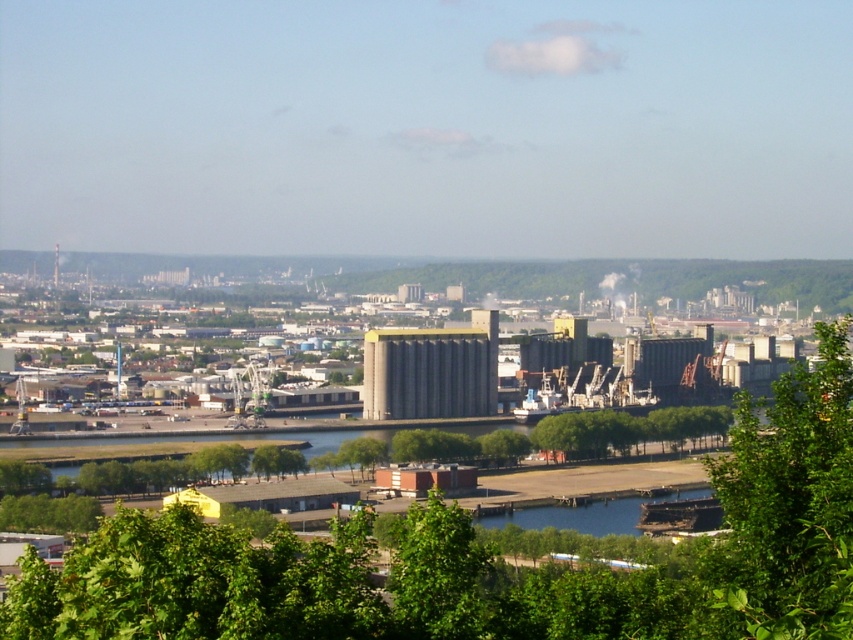
Between green leafy tree at lower right and gray concrete silos at center, which one is positioned lower?

green leafy tree at lower right

Between green leafy tree at lower right and gray concrete silos at center, which one appears on the right side from the viewer's perspective?

green leafy tree at lower right is more to the right.

Is point (837, 346) positioned in front of point (437, 353)?

That is False.

Where is `green leafy tree at lower right`? green leafy tree at lower right is located at coordinates (790, 502).

Measure the distance between gray concrete silos at center and camera.

gray concrete silos at center is 646.85 meters away from camera.

Between gray concrete silos at center and green leafy tree at lower left, which one appears on the right side from the viewer's perspective?

gray concrete silos at center

Between point (466, 355) and point (0, 520), which one is positioned in front?

Point (466, 355)

You are a GUI agent. You are given a task and a screenshot of the screen. Output one action in this format:
    pyautogui.click(x=<x>, y=<y>)
    Task: Click on the gray concrete silos at center
    The width and height of the screenshot is (853, 640).
    Given the screenshot: What is the action you would take?
    pyautogui.click(x=431, y=371)

Who is positioned more to the left, green leafy tree at lower left or green leafy tree at center?

green leafy tree at lower left is more to the left.

Based on the photo, can you confirm if green leafy tree at lower left is positioned to the right of green leafy tree at center?

In fact, green leafy tree at lower left is to the left of green leafy tree at center.

Is point (20, 502) in front of point (395, 442)?

No, it is behind (395, 442).

Find the location of a particular element. green leafy tree at lower left is located at coordinates (48, 513).